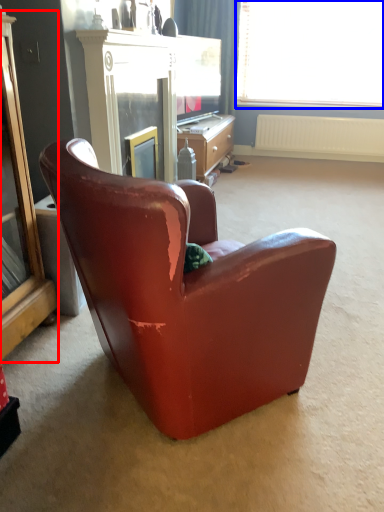
Question: Which of the following is the farthest to the observer, cabinetry (highlighted by a red box) or window (highlighted by a blue box)?

Choices:
 (A) cabinetry
 (B) window

Answer: (B)